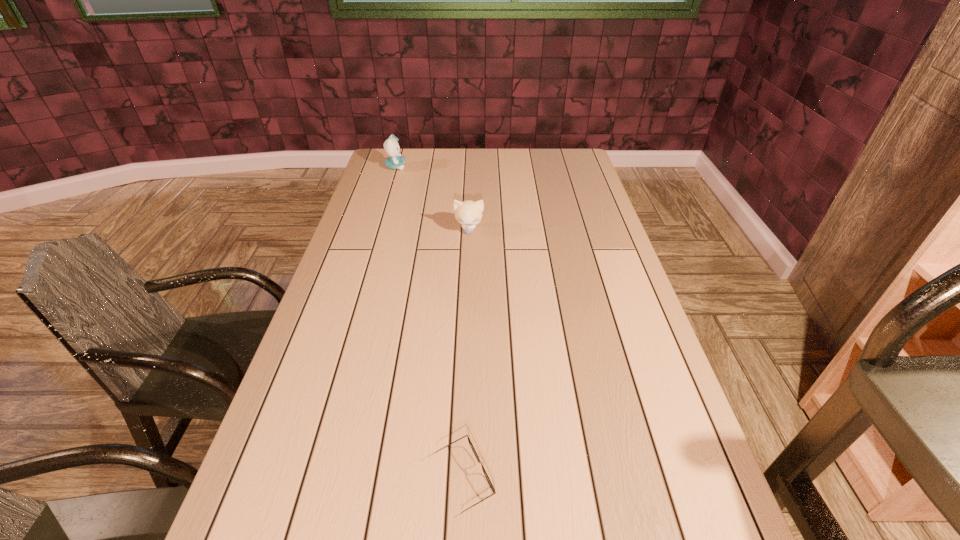
I want to click on the left kitten, so click(391, 146).

Locate an element on the screen. the farthest object is located at coordinates (391, 146).

Locate an element on the screen. the second nearest object is located at coordinates (468, 213).

At what (x,y) coordinates should I click in order to perform the action: click on the nearer kitten. Please return your answer as a coordinate pair (x, y). Looking at the image, I should click on (468, 213).

Locate an element on the screen. The height and width of the screenshot is (540, 960). the shortest object is located at coordinates (471, 445).

You are a GUI agent. You are given a task and a screenshot of the screen. Output one action in this format:
    pyautogui.click(x=<x>, y=<y>)
    Task: Click on the spectacles
    The image size is (960, 540).
    Given the screenshot: What is the action you would take?
    pyautogui.click(x=471, y=445)

Identify the location of blank space located on the face of the leftmost object. (444, 167).

Locate an element on the screen. The width and height of the screenshot is (960, 540). blank space located 0.160m on the face of the second farthest object is located at coordinates (468, 268).

At what (x,y) coordinates should I click in order to perform the action: click on blank space located with the lenses facing outward on the nearest object. Please return your answer as a coordinate pair (x, y). The image size is (960, 540). Looking at the image, I should click on (537, 479).

At what (x,y) coordinates should I click in order to perform the action: click on object present at the far edge. Please return your answer as a coordinate pair (x, y). This screenshot has height=540, width=960. Looking at the image, I should click on (391, 146).